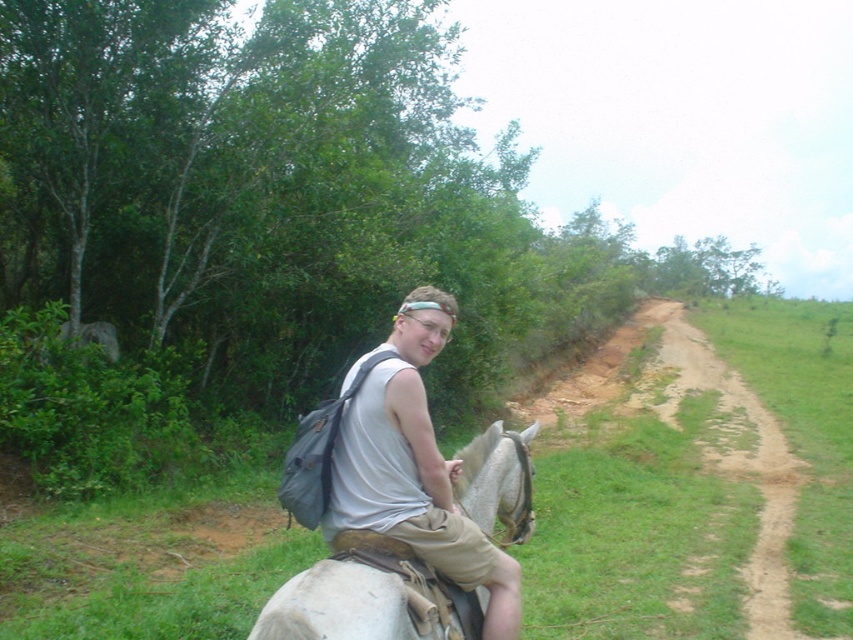
Question: Is gray fabric backpack at center positioned behind brown dirt path at center right?

Choices:
 (A) yes
 (B) no

Answer: (B)

Question: Among these objects, which one is farthest from the camera?

Choices:
 (A) brown dirt path at center right
 (B) gray fabric backpack at center
 (C) white matte horse at center

Answer: (A)

Question: Is gray fabric backpack at center in front of brown dirt path at center right?

Choices:
 (A) no
 (B) yes

Answer: (B)

Question: Can you confirm if gray fabric backpack at center is positioned to the right of brown dirt path at center right?

Choices:
 (A) yes
 (B) no

Answer: (B)

Question: Which of the following is the closest to the observer?

Choices:
 (A) white matte horse at center
 (B) gray fabric backpack at center
 (C) brown dirt path at center right

Answer: (A)

Question: Which of the following is the closest to the observer?

Choices:
 (A) (297, 577)
 (B) (360, 410)
 (C) (780, 481)

Answer: (A)